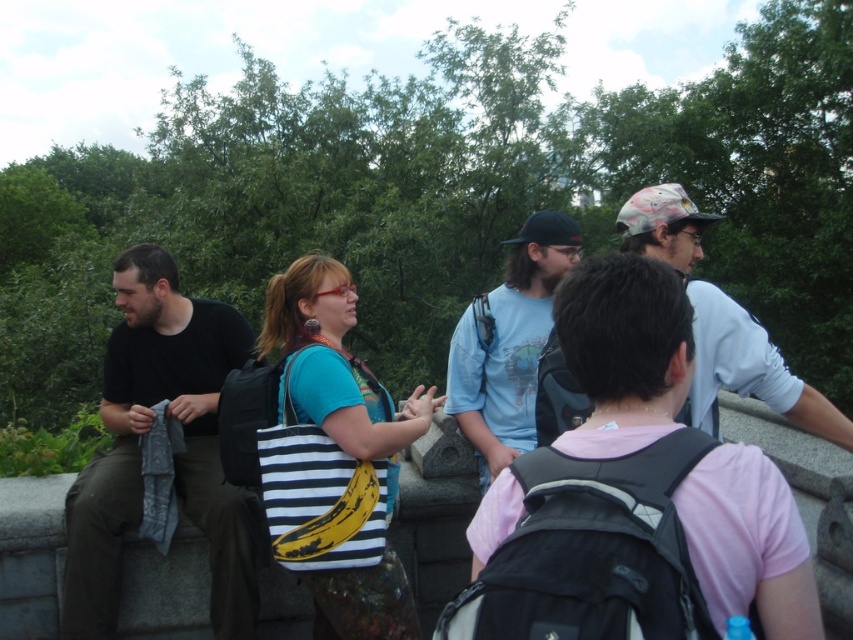
Which is in front, point (115, 428) or point (521, 422)?

Point (521, 422) is more forward.

Is black matte shirt at left above light blue t-shirt at center?

Actually, black matte shirt at left is below light blue t-shirt at center.

Is point (167, 396) behind point (454, 388)?

Yes, point (167, 396) is farther from viewer.

At what (x,y) coordinates should I click in order to perform the action: click on black matte shirt at left. Please return your answer as a coordinate pair (x, y). Image resolution: width=853 pixels, height=640 pixels. Looking at the image, I should click on (173, 456).

Does light blue t-shirt at center have a larger size compared to camouflage fabric cap at upper right?

No, light blue t-shirt at center is not bigger than camouflage fabric cap at upper right.

Who is higher up, light blue t-shirt at center or camouflage fabric cap at upper right?

camouflage fabric cap at upper right is above.

Who is more distant from viewer, (460, 349) or (718, 365)?

Positioned behind is point (460, 349).

I want to click on light blue t-shirt at center, so click(x=508, y=342).

Can you confirm if black matte shirt at left is positioned below camouflage fabric cap at upper right?

Yes, black matte shirt at left is below camouflage fabric cap at upper right.

Where is `black matte shirt at left`? The image size is (853, 640). black matte shirt at left is located at coordinates (173, 456).